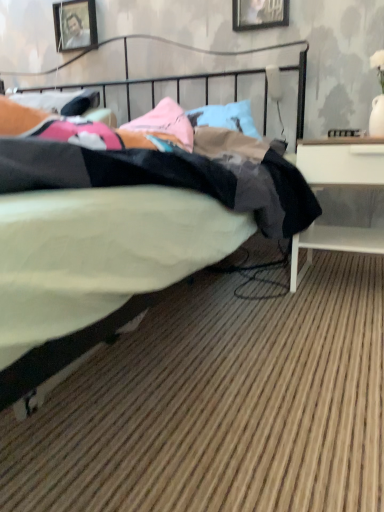
Question: Does wooden picture frame at upper center, which is counted as the first picture frame, starting from the front, appear on the right side of wooden picture frame at upper left, which is counted as the second picture frame, starting from the front?

Choices:
 (A) no
 (B) yes

Answer: (B)

Question: Considering the relative sizes of wooden picture frame at upper center, which is counted as the first picture frame, starting from the front, and wooden picture frame at upper left, arranged as the first picture frame when viewed from the left, in the image provided, is wooden picture frame at upper center, which is counted as the first picture frame, starting from the front, shorter than wooden picture frame at upper left, arranged as the first picture frame when viewed from the left,?

Choices:
 (A) no
 (B) yes

Answer: (A)

Question: Is wooden picture frame at upper center, marked as the 2th picture frame in a back-to-front arrangement, oriented towards wooden picture frame at upper left, arranged as the first picture frame when viewed from the left?

Choices:
 (A) yes
 (B) no

Answer: (B)

Question: Considering the relative sizes of wooden picture frame at upper center, the 2th picture frame positioned from the left, and wooden picture frame at upper left, which is counted as the second picture frame, starting from the right, in the image provided, is wooden picture frame at upper center, the 2th picture frame positioned from the left, taller than wooden picture frame at upper left, which is counted as the second picture frame, starting from the right,?

Choices:
 (A) yes
 (B) no

Answer: (A)

Question: Is wooden picture frame at upper center, the 2th picture frame positioned from the left, beside wooden picture frame at upper left, arranged as the first picture frame when viewed from the left?

Choices:
 (A) yes
 (B) no

Answer: (B)

Question: In terms of height, does wooden picture frame at upper left, which is counted as the second picture frame, starting from the right, look taller or shorter compared to wooden picture frame at upper center, marked as the 2th picture frame in a back-to-front arrangement?

Choices:
 (A) short
 (B) tall

Answer: (A)

Question: From the image's perspective, relative to wooden picture frame at upper center, marked as the 2th picture frame in a back-to-front arrangement, is wooden picture frame at upper left, which is counted as the second picture frame, starting from the front, above or below?

Choices:
 (A) above
 (B) below

Answer: (A)

Question: From a real-world perspective, relative to wooden picture frame at upper center, marked as the 2th picture frame in a back-to-front arrangement, is wooden picture frame at upper left, arranged as the first picture frame when viewed from the left, vertically above or below?

Choices:
 (A) above
 (B) below

Answer: (B)

Question: Choose the correct answer: Is wooden picture frame at upper left, which is counted as the second picture frame, starting from the right, inside wooden picture frame at upper center, which is counted as the first picture frame, starting from the front, or outside it?

Choices:
 (A) inside
 (B) outside

Answer: (B)

Question: From a real-world perspective, is black fabric bed at center positioned above or below wooden picture frame at upper center, which is counted as the first picture frame, starting from the front?

Choices:
 (A) below
 (B) above

Answer: (A)

Question: Considering the positions of black fabric bed at center and wooden picture frame at upper center, which appears as the first picture frame when viewed from the right, in the image, is black fabric bed at center bigger or smaller than wooden picture frame at upper center, which appears as the first picture frame when viewed from the right,?

Choices:
 (A) small
 (B) big

Answer: (B)

Question: Relative to wooden picture frame at upper center, which is counted as the first picture frame, starting from the front, is black fabric bed at center in front or behind?

Choices:
 (A) front
 (B) behind

Answer: (A)

Question: Is point (228, 210) closer or farther from the camera than point (251, 27)?

Choices:
 (A) farther
 (B) closer

Answer: (B)

Question: Is wooden picture frame at upper left, which is counted as the second picture frame, starting from the front, to the left or to the right of black fabric bed at center in the image?

Choices:
 (A) left
 (B) right

Answer: (B)

Question: Relative to black fabric bed at center, is wooden picture frame at upper left, which is counted as the second picture frame, starting from the right, in front or behind?

Choices:
 (A) behind
 (B) front

Answer: (A)